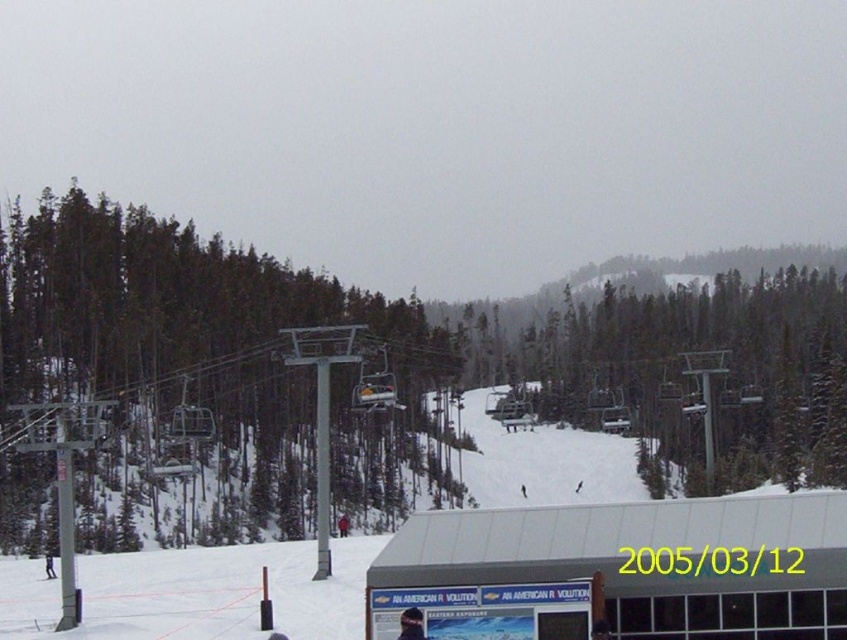
In the scene shown: Is green matte tree at left below white matte building at lower center?

Indeed, green matte tree at left is positioned under white matte building at lower center.

Is green matte tree at left shorter than white matte building at lower center?

Incorrect, green matte tree at left's height does not fall short of white matte building at lower center's.

Which is behind, point (34, 296) or point (666, 588)?

The point (34, 296) is behind.

Where is `green matte tree at left`? green matte tree at left is located at coordinates (375, 369).

Is green matte tree at left below white plastic ski at lower left?

Incorrect, green matte tree at left is not positioned below white plastic ski at lower left.

Who is shorter, green matte tree at left or white plastic ski at lower left?

Standing shorter between the two is white plastic ski at lower left.

Between point (115, 467) and point (48, 566), which one is positioned in front?

Positioned in front is point (48, 566).

Where is `green matte tree at left`? This screenshot has height=640, width=847. green matte tree at left is located at coordinates (375, 369).

Which is in front, point (623, 611) or point (40, 577)?

Point (623, 611) is in front.

Is white matte building at lower center bigger than white plastic ski at lower left?

Yes, white matte building at lower center is bigger than white plastic ski at lower left.

Identify the location of white matte building at lower center. (619, 570).